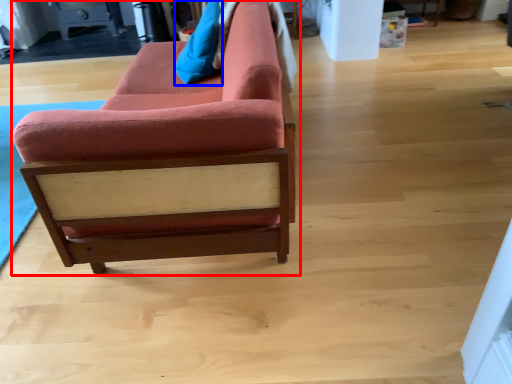
Question: Which object is closer to the camera taking this photo, studio couch (highlighted by a red box) or pillow (highlighted by a blue box)?

Choices:
 (A) studio couch
 (B) pillow

Answer: (A)